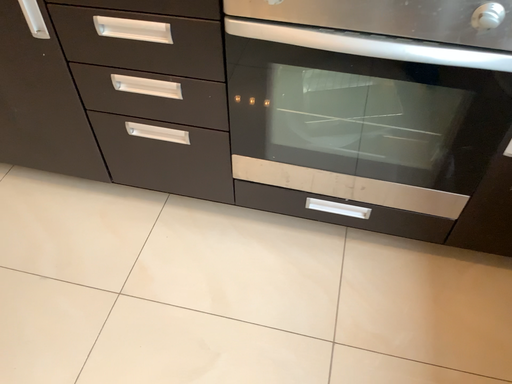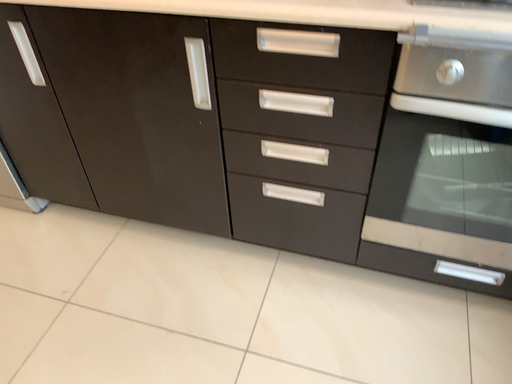
Question: How did the camera likely rotate when shooting the video?

Choices:
 (A) rotated downward
 (B) rotated upward

Answer: (B)